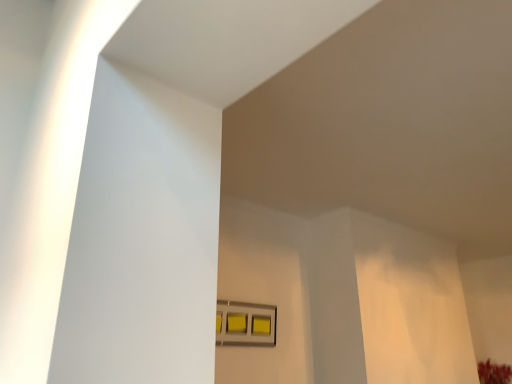
Find the location of a particular element. matte yellow window at lower center is located at coordinates coord(245,324).

What do you see at coordinates (245, 324) in the screenshot? I see `matte yellow window at lower center` at bounding box center [245, 324].

What is the approximate width of matte yellow window at lower center?

matte yellow window at lower center is 3.47 inches in width.

You are a GUI agent. You are given a task and a screenshot of the screen. Output one action in this format:
    pyautogui.click(x=<x>, y=<y>)
    Task: Click on the matte yellow window at lower center
    Image resolution: width=512 pixels, height=384 pixels.
    Given the screenshot: What is the action you would take?
    pyautogui.click(x=245, y=324)